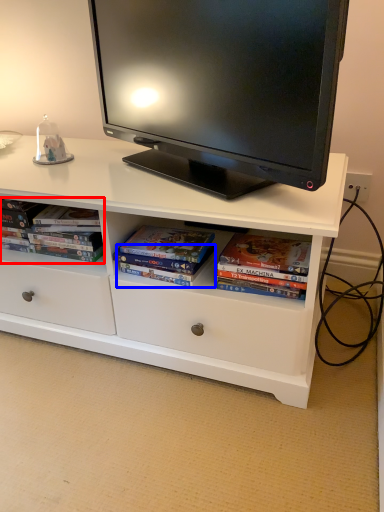
Question: Which object is closer to the camera taking this photo, book (highlighted by a red box) or paperback book (highlighted by a blue box)?

Choices:
 (A) book
 (B) paperback book

Answer: (B)